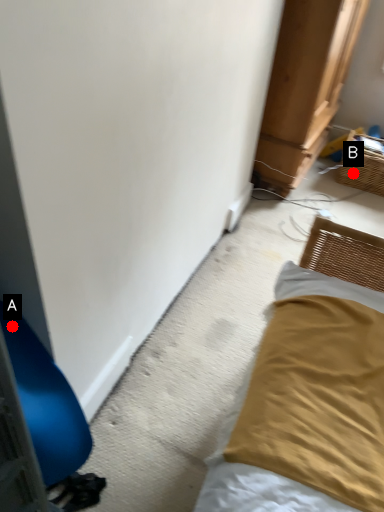
Question: Two points are circled on the image, labeled by A and B beside each circle. Which point appears closest to the camera in this image?

Choices:
 (A) A is closer
 (B) B is closer

Answer: (A)